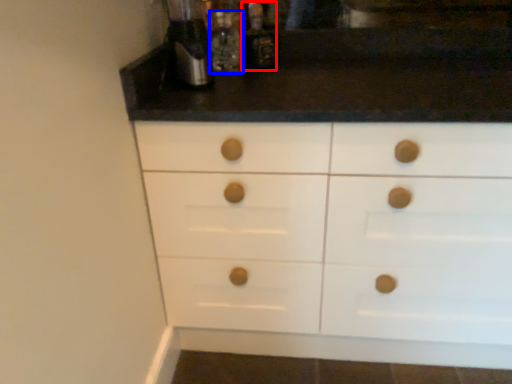
Question: Which object appears farthest to the camera in this image, bottle (highlighted by a red box) or bottle (highlighted by a blue box)?

Choices:
 (A) bottle
 (B) bottle

Answer: (A)